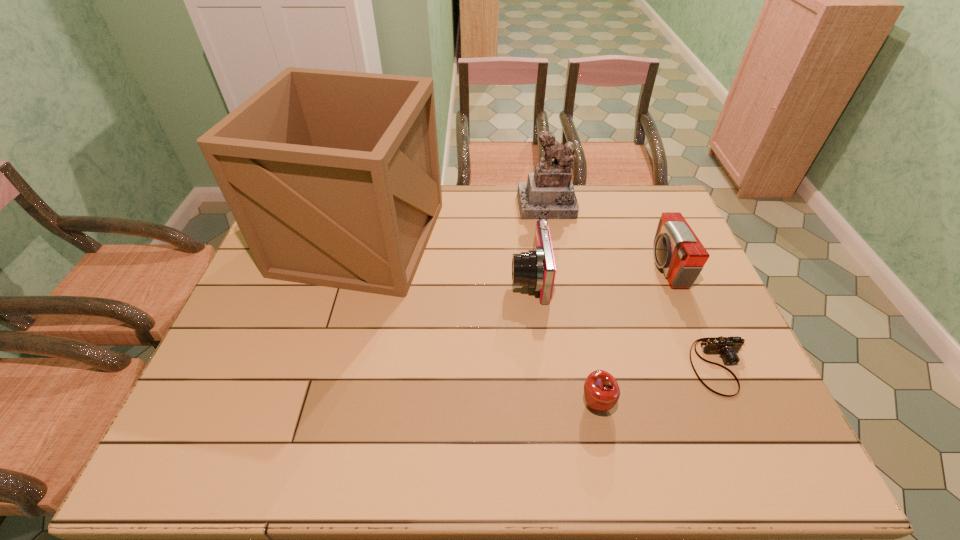
Identify which object is the nearest to the apple. Please provide its 2D coordinates. Your answer should be formatted as a tuple, i.e. [(x, y)], where the tuple contains the x and y coordinates of a point satisfying the conditions above.

[(728, 347)]

Choose which object is the third nearest neighbor to the shortest camera. Please provide its 2D coordinates. Your answer should be formatted as a tuple, i.e. [(x, y)], where the tuple contains the x and y coordinates of a point satisfying the conditions above.

[(536, 269)]

At what (x,y) coordinates should I click in order to perform the action: click on the second closest camera relative to the box. Please return your answer as a coordinate pair (x, y). Image resolution: width=960 pixels, height=540 pixels. Looking at the image, I should click on (677, 250).

Locate an element on the screen. The height and width of the screenshot is (540, 960). camera that can be found as the closest to the fifth shortest object is located at coordinates (536, 269).

This screenshot has width=960, height=540. I want to click on vacant region that satisfies the following two spatial constraints: 1. on the front-facing side of the fifth shortest object; 2. on the front-facing side of the leftmost camera, so click(561, 278).

The height and width of the screenshot is (540, 960). In order to click on free location that satisfies the following two spatial constraints: 1. on the front-facing side of the apple; 2. on the right side of the figurine in this screenshot , I will do `click(583, 404)`.